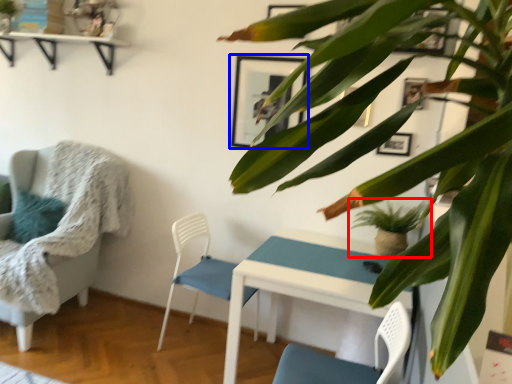
Question: Which object appears closest to the camera in this image, houseplant (highlighted by a red box) or picture frame (highlighted by a blue box)?

Choices:
 (A) houseplant
 (B) picture frame

Answer: (A)